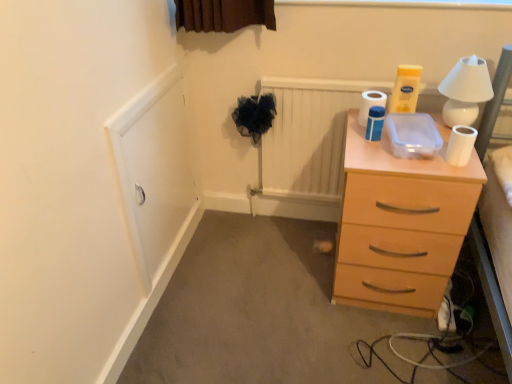
This screenshot has width=512, height=384. Find the location of `free point to the left of white matte toilet paper at upper right, positioned as the 1th toilet paper in right-to-left order`. free point to the left of white matte toilet paper at upper right, positioned as the 1th toilet paper in right-to-left order is located at coordinates (416, 159).